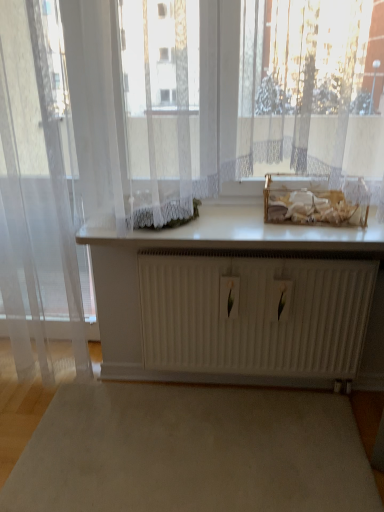
Locate an element on the screen. The height and width of the screenshot is (512, 384). free space to the left of white matte radiator at center is located at coordinates tap(137, 425).